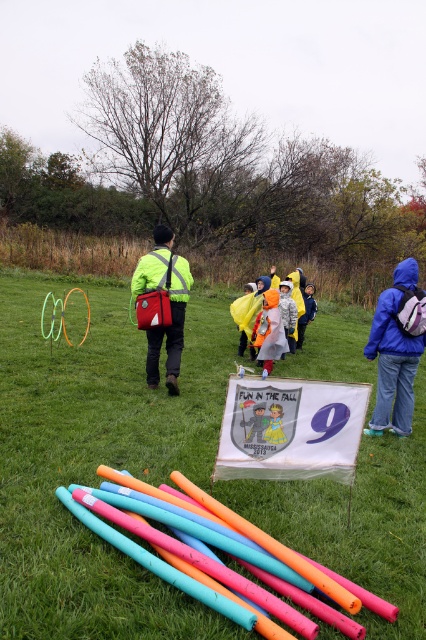
At what (x,y) coordinates should I click in order to perform the action: click on green grass at center. Please return your answer as a coordinate pair (x, y). This screenshot has height=640, width=426. Looking at the image, I should click on (98, 461).

Looking at this image, is green grass at center further to the viewer compared to orange raincoat at center?

No, it is in front of orange raincoat at center.

Find the location of a particular element. The image size is (426, 640). green grass at center is located at coordinates (98, 461).

Does raincoat fabric at center appear under orange raincoat at center?

No, raincoat fabric at center is not below orange raincoat at center.

Image resolution: width=426 pixels, height=640 pixels. What do you see at coordinates (268, 321) in the screenshot?
I see `raincoat fabric at center` at bounding box center [268, 321].

Where is `raincoat fabric at center`? The width and height of the screenshot is (426, 640). raincoat fabric at center is located at coordinates (268, 321).

Can you confirm if blue fleece jacket at right is shorter than raincoat fabric at center?

No.

Which is in front, point (414, 301) or point (276, 353)?

Point (414, 301)

The width and height of the screenshot is (426, 640). Identify the location of blue fleece jacket at right. (396, 349).